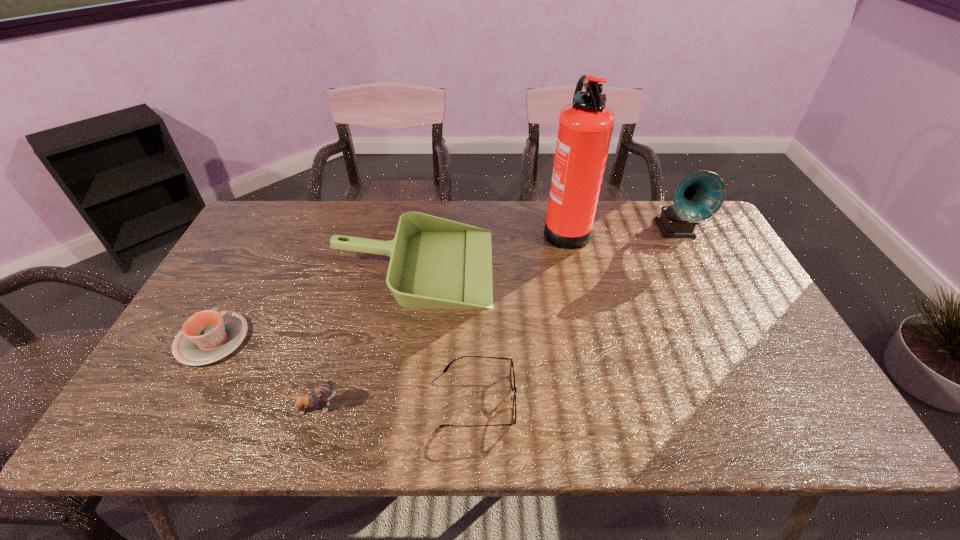
Where is `phonograph_record situated at the far edge`? Image resolution: width=960 pixels, height=540 pixels. phonograph_record situated at the far edge is located at coordinates (700, 195).

Where is `dustpan that is positioned at the far edge`? The image size is (960, 540). dustpan that is positioned at the far edge is located at coordinates (435, 263).

Identify the location of kitten that is at the near edge. (323, 391).

The image size is (960, 540). What are the coordinates of `spectacles that is at the near edge` in the screenshot? It's located at (512, 374).

Image resolution: width=960 pixels, height=540 pixels. Identify the location of object that is at the left edge. (208, 336).

This screenshot has height=540, width=960. I want to click on object that is at the right edge, so click(700, 195).

Locate an element on the screen. object located at the far right corner is located at coordinates (700, 195).

I want to click on free space at the far edge, so click(321, 211).

Image resolution: width=960 pixels, height=540 pixels. I want to click on vacant space at the near edge, so click(637, 415).

Identify the location of free spot at the far left corner of the desktop. (289, 224).